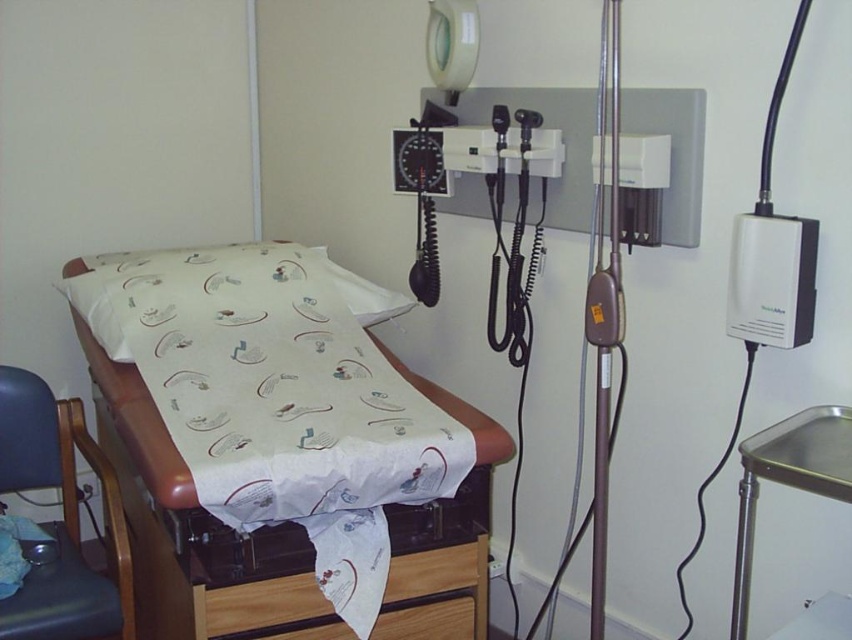
You are a patient in the examination room and want to reach the point at coordinate point (x=262, y=275) from point (x=9, y=608). Which direction should you move?

Since point (x=262, y=275) is behind point (x=9, y=608), you should move backward to reach it.

You are a patient entering the examination room and need to sit down. Which object, the white printed fabric at center or the blue fabric chair at lower left, is closer to you when you first enter the room?

The white printed fabric at center is closer to the viewer than the blue fabric chair at lower left, so the white printed fabric at center is closer when you first enter the room.